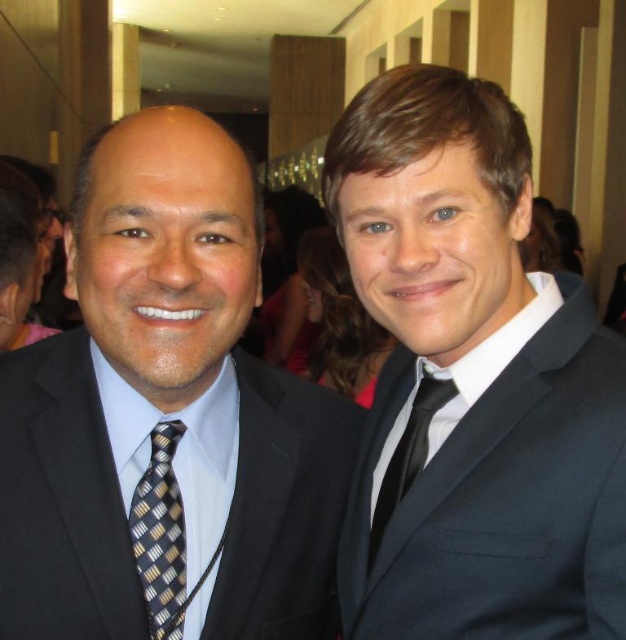
Question: Considering the relative positions of black silk suit at left and matte black suit at right in the image provided, where is black silk suit at left located with respect to matte black suit at right?

Choices:
 (A) right
 (B) left

Answer: (B)

Question: Which of the following is the farthest from the observer?

Choices:
 (A) (414, 440)
 (B) (141, 304)

Answer: (A)

Question: Among these points, which one is farthest from the camera?

Choices:
 (A) (387, 307)
 (B) (167, 588)
 (C) (227, 228)
 (D) (409, 438)

Answer: (D)

Question: Does matte black suit at right appear over black and gold striped tie at left?

Choices:
 (A) no
 (B) yes

Answer: (B)

Question: Among these objects, which one is nearest to the camera?

Choices:
 (A) black silk tie at right
 (B) matte black suit at right

Answer: (B)

Question: Can you confirm if black silk suit at left is positioned above black silk tie at right?

Choices:
 (A) yes
 (B) no

Answer: (A)